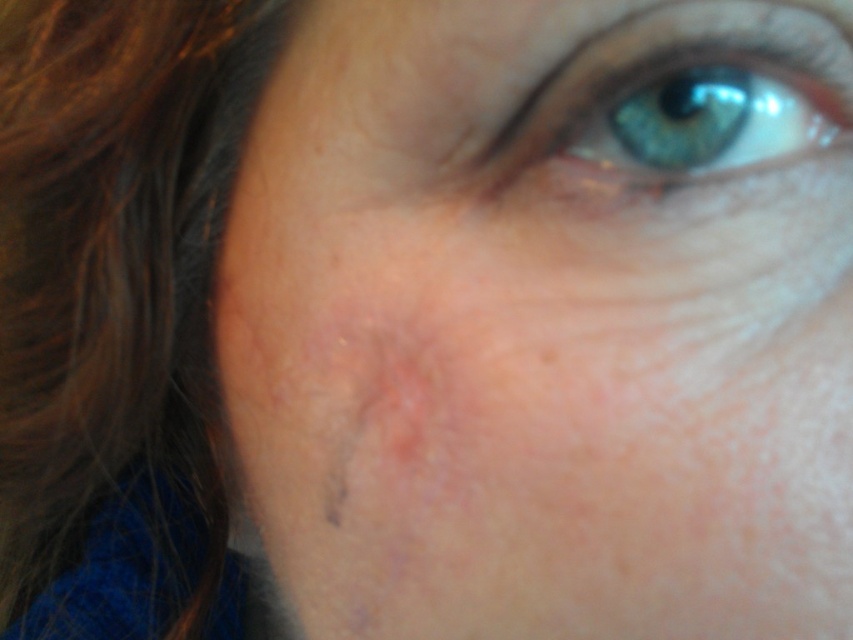
Question: Observing the image, what is the correct spatial positioning of brown silky hair at left in reference to blue iridescent eye at upper center?

Choices:
 (A) below
 (B) above

Answer: (A)

Question: Does brown silky hair at left have a lesser width compared to blue iridescent eye at upper center?

Choices:
 (A) yes
 (B) no

Answer: (B)

Question: Is brown silky hair at left in front of blue iridescent eye at upper center?

Choices:
 (A) no
 (B) yes

Answer: (A)

Question: Which point is closer to the camera taking this photo?

Choices:
 (A) (158, 388)
 (B) (646, 163)

Answer: (B)

Question: Which object is closer to the camera taking this photo?

Choices:
 (A) brown silky hair at left
 (B) blue iridescent eye at upper center

Answer: (B)